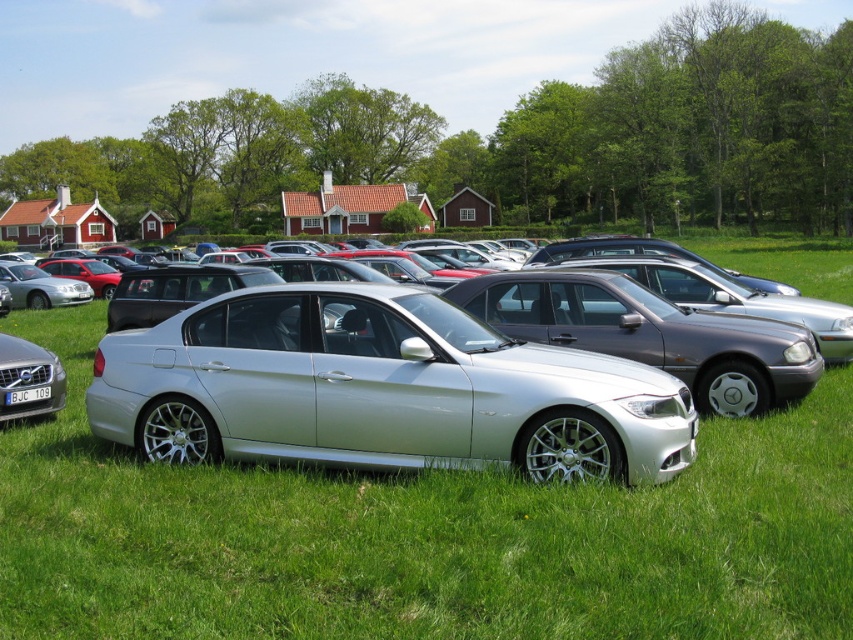
Can you confirm if silver metallic sedan at center is taller than silver metallic volvo at lower left?

Yes.

Which is more to the right, silver metallic sedan at center or silver metallic volvo at lower left?

silver metallic sedan at center is more to the right.

Image resolution: width=853 pixels, height=640 pixels. What do you see at coordinates (381, 388) in the screenshot?
I see `silver metallic sedan at center` at bounding box center [381, 388].

Identify the location of silver metallic sedan at center. (381, 388).

Is silver metallic car at center thinner than silver metallic volvo at lower left?

No, silver metallic car at center is not thinner than silver metallic volvo at lower left.

The image size is (853, 640). Describe the element at coordinates (421, 536) in the screenshot. I see `silver metallic car at center` at that location.

Describe the element at coordinates (421, 536) in the screenshot. The image size is (853, 640). I see `silver metallic car at center` at that location.

Find the location of `silver metallic car at center`. silver metallic car at center is located at coordinates (421, 536).

Does silver metallic car at center appear under silver metallic sedan at center?

Incorrect, silver metallic car at center is not positioned below silver metallic sedan at center.

Is silver metallic car at center further to the viewer compared to silver metallic sedan at center?

No, silver metallic car at center is in front of silver metallic sedan at center.

You are a GUI agent. You are given a task and a screenshot of the screen. Output one action in this format:
    pyautogui.click(x=<x>, y=<y>)
    Task: Click on the silver metallic car at center
    
    Given the screenshot: What is the action you would take?
    pyautogui.click(x=421, y=536)

You are a GUI agent. You are given a task and a screenshot of the screen. Output one action in this format:
    pyautogui.click(x=<x>, y=<y>)
    Task: Click on the silver metallic car at center
    This screenshot has height=640, width=853.
    Given the screenshot: What is the action you would take?
    pyautogui.click(x=421, y=536)